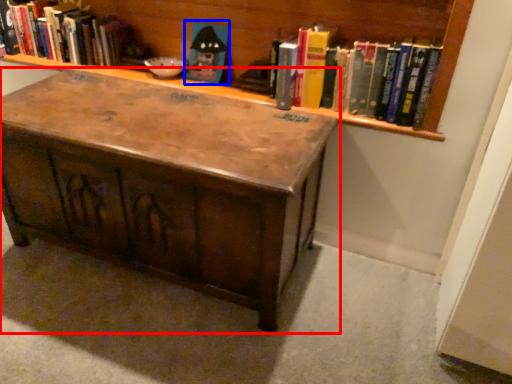
Question: Which of the following is the farthest to the observer, table (highlighted by a red box) or toy (highlighted by a blue box)?

Choices:
 (A) table
 (B) toy

Answer: (B)